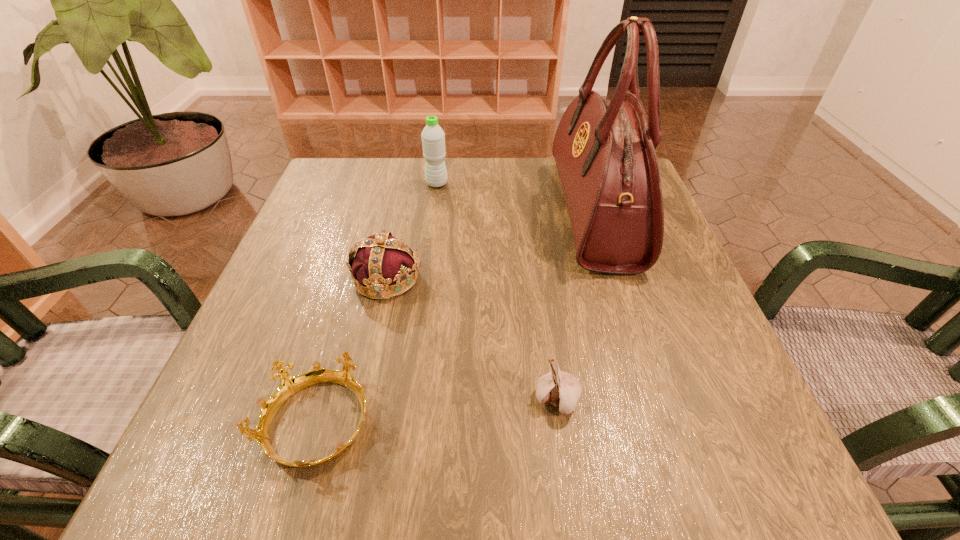
You are a GUI agent. You are given a task and a screenshot of the screen. Output one action in this format:
    pyautogui.click(x=<x>, y=<y>)
    Task: Click on the blank region between the shortest object and the second shortest object
    
    Given the screenshot: What is the action you would take?
    pyautogui.click(x=438, y=412)

What are the coordinates of `free point between the garlic and the fourth shortest object` in the screenshot? It's located at (497, 292).

The image size is (960, 540). I want to click on free area in between the fourth tallest object and the nearer crown, so click(438, 412).

You are a GUI agent. You are given a task and a screenshot of the screen. Output one action in this format:
    pyautogui.click(x=<x>, y=<y>)
    Task: Click on the vacant space that is in between the handbag and the shorter crown
    This screenshot has width=960, height=540.
    Given the screenshot: What is the action you would take?
    pyautogui.click(x=457, y=318)

Find the location of a particular element. The height and width of the screenshot is (540, 960). vacant area that lies between the farther crown and the shorter crown is located at coordinates (352, 351).

Locate an element on the screen. This screenshot has width=960, height=540. vacant area between the shortest object and the water bottle is located at coordinates (377, 304).

Find the location of a particular element. This screenshot has width=960, height=540. free point between the third shortest object and the shorter crown is located at coordinates (352, 351).

Locate which object is the third closest to the handbag. Please provide its 2D coordinates. Your answer should be formatted as a tuple, i.e. [(x, y)], where the tuple contains the x and y coordinates of a point satisfying the conditions above.

[(381, 260)]

Locate which object ranks in proximity to the shortest object. Please provide its 2D coordinates. Your answer should be formatted as a tuple, i.e. [(x, y)], where the tuple contains the x and y coordinates of a point satisfying the conditions above.

[(381, 260)]

This screenshot has height=540, width=960. I want to click on vacant area that satisfies the following two spatial constraints: 1. on the back side of the water bottle; 2. on the right side of the shorter crown, so click(x=386, y=184).